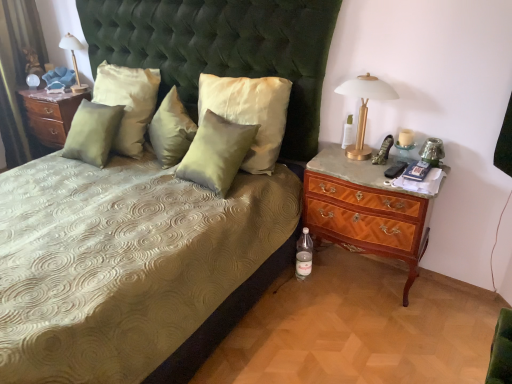
Identify the location of vacant area that is situated to the right of clear plastic bottle at lower right, the 1th bottle from the bottom. pyautogui.click(x=331, y=279).